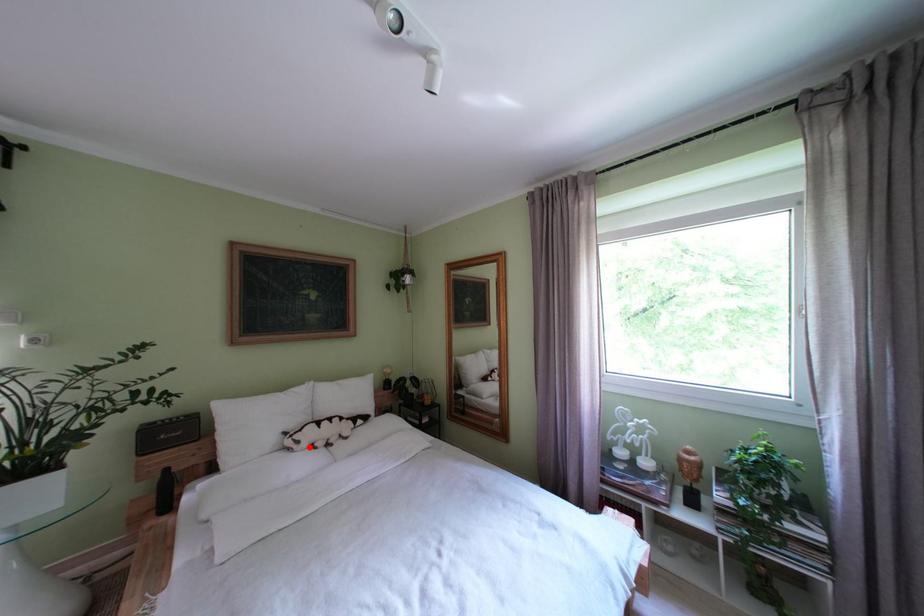
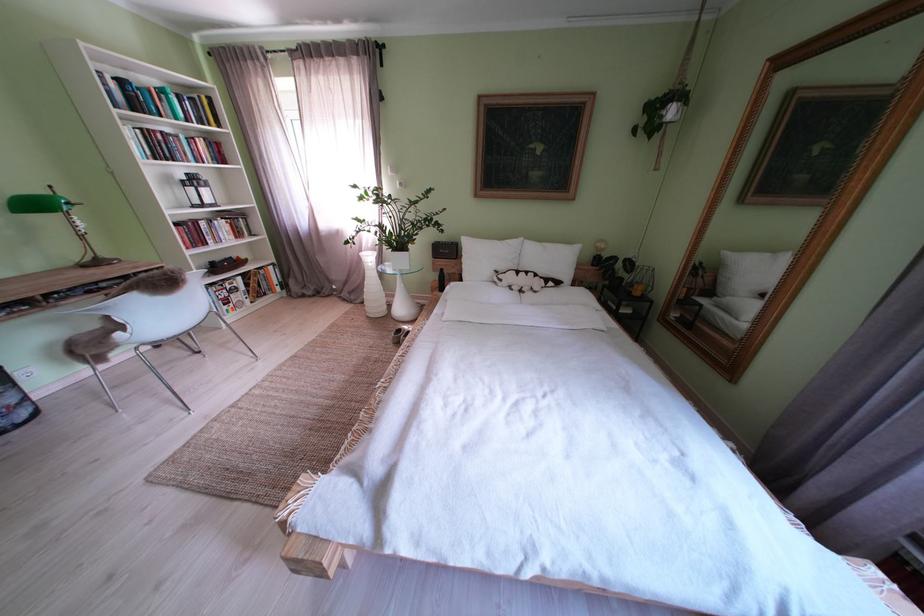
Question: A red point is marked in image1. In image2, is the corresponding 3D point closer to the camera or farther? Reply with the corresponding letter.

Choices:
 (A) The corresponding 3D point is closer.
 (B) The corresponding 3D point is farther.

Answer: (A)